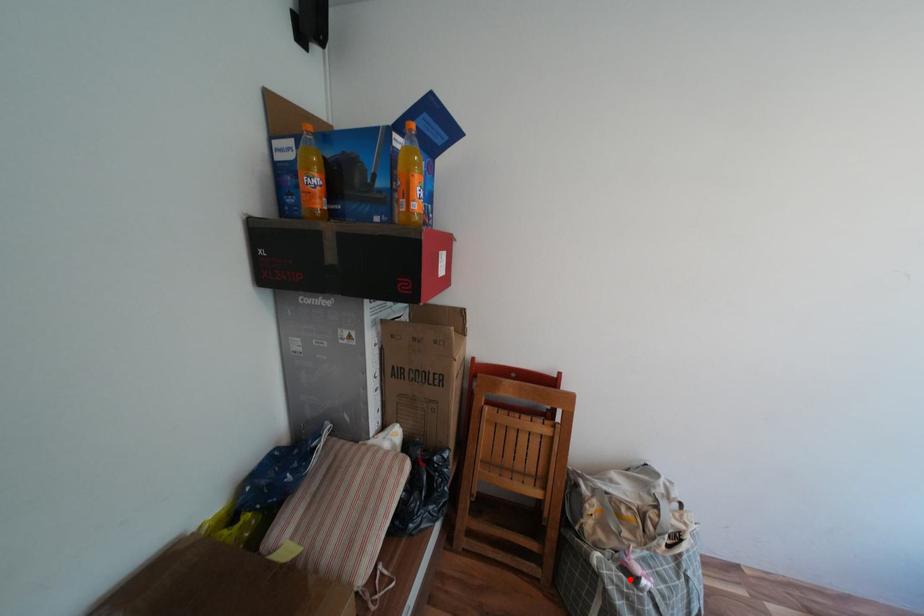
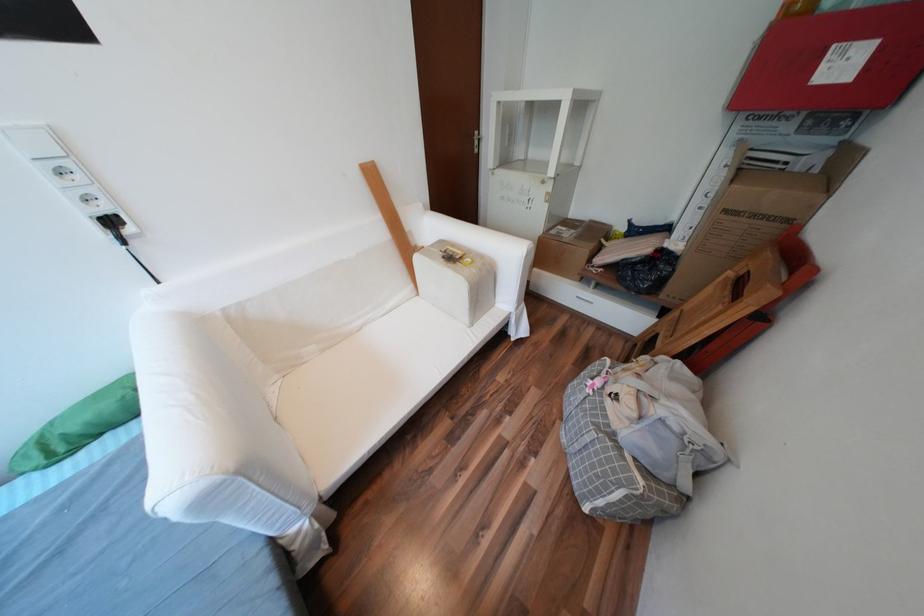
Question: I am providing you with two images of the same scene from different viewpoints. A red point is shown in image1. For the corresponding object point in image2, is it positioned nearer or farther from the camera?

Choices:
 (A) Nearer
 (B) Farther

Answer: (A)